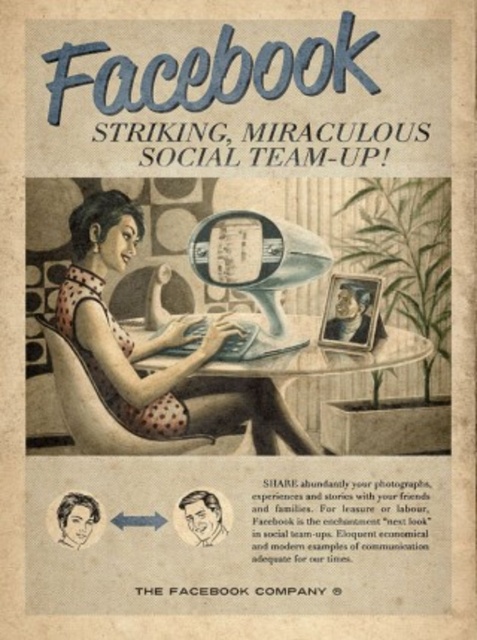
Who is more distant from viewer, (198, 422) or (334, 364)?

Point (334, 364)

Between polka dot fabric dress at center and translucent glass table at center, which one is positioned lower?

translucent glass table at center is lower down.

At what (x,y) coordinates should I click in order to perform the action: click on polka dot fabric dress at center. Please return your answer as a coordinate pair (x, y). The height and width of the screenshot is (640, 477). Looking at the image, I should click on (149, 355).